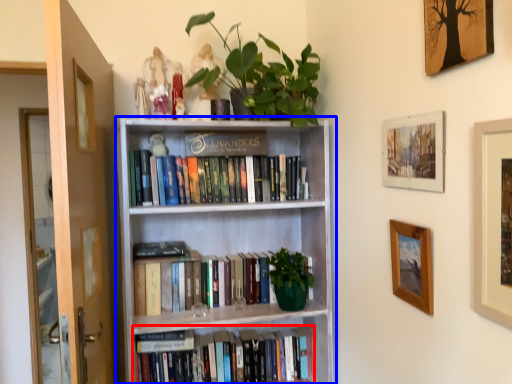
Question: Which object appears closest to the camera in this image, book (highlighted by a red box) or bookcase (highlighted by a blue box)?

Choices:
 (A) book
 (B) bookcase

Answer: (B)